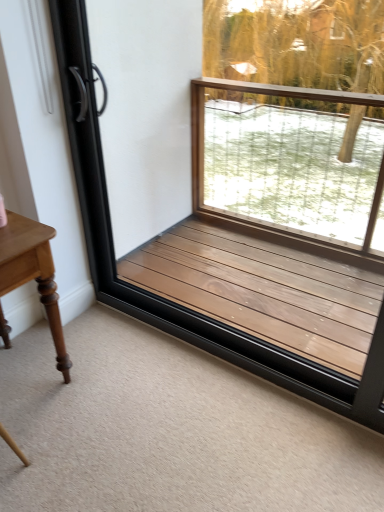
Question: Is light brown wood table at left smaller than brown wood window frame at center?

Choices:
 (A) yes
 (B) no

Answer: (A)

Question: Is light brown wood table at left further to camera compared to brown wood window frame at center?

Choices:
 (A) no
 (B) yes

Answer: (B)

Question: Is light brown wood table at left aimed at brown wood window frame at center?

Choices:
 (A) yes
 (B) no

Answer: (B)

Question: From the image's perspective, is light brown wood table at left below brown wood window frame at center?

Choices:
 (A) yes
 (B) no

Answer: (A)

Question: Can you confirm if light brown wood table at left is wider than brown wood window frame at center?

Choices:
 (A) no
 (B) yes

Answer: (B)

Question: Is light brown wood table at left not close to brown wood window frame at center?

Choices:
 (A) yes
 (B) no

Answer: (B)

Question: From a real-world perspective, is brown wood window frame at center physically below light brown wood table at left?

Choices:
 (A) no
 (B) yes

Answer: (A)

Question: From a real-world perspective, is brown wood window frame at center positioned over light brown wood table at left based on gravity?

Choices:
 (A) yes
 (B) no

Answer: (A)

Question: Would you say light brown wood table at left is part of brown wood window frame at center's contents?

Choices:
 (A) yes
 (B) no

Answer: (B)

Question: From the image's perspective, is brown wood window frame at center below light brown wood table at left?

Choices:
 (A) no
 (B) yes

Answer: (A)

Question: Does brown wood window frame at center lie behind light brown wood table at left?

Choices:
 (A) yes
 (B) no

Answer: (B)

Question: Is brown wood window frame at center outside light brown wood table at left?

Choices:
 (A) no
 (B) yes

Answer: (B)

Question: From the image's perspective, relative to light brown wood table at left, is brown wood window frame at center above or below?

Choices:
 (A) above
 (B) below

Answer: (A)